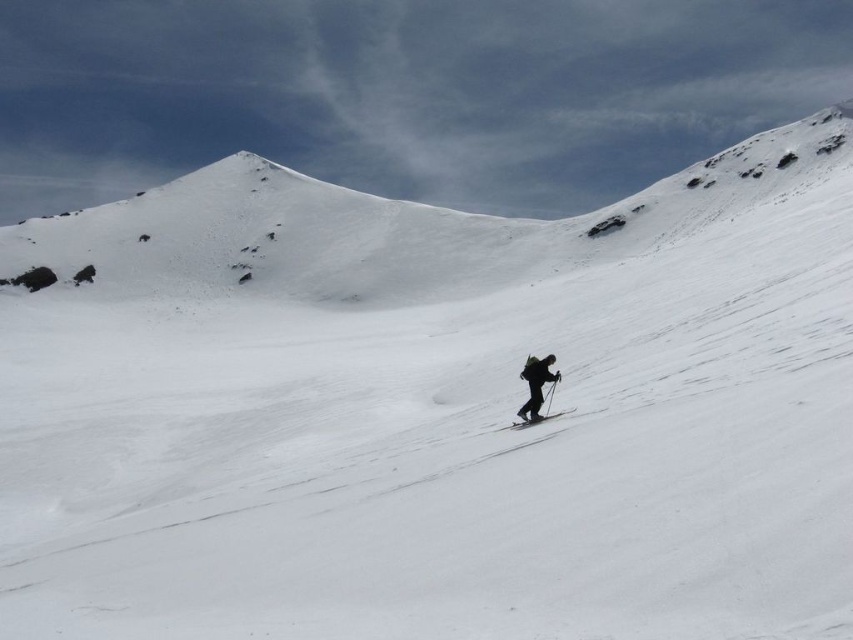
Question: Among these points, which one is nearest to the camera?

Choices:
 (A) (520, 372)
 (B) (550, 416)
 (C) (518, 413)

Answer: (B)

Question: Estimate the real-world distances between objects in this image. Which object is farther from the black fabric backpack at center?

Choices:
 (A) black matte snowboarder at center
 (B) white snow-covered mountain at upper center
 (C) black matte ski at center

Answer: (B)

Question: Is white snow-covered mountain at upper center closer to the viewer compared to black fabric backpack at center?

Choices:
 (A) no
 (B) yes

Answer: (A)

Question: Does black fabric backpack at center appear on the right side of black matte ski at center?

Choices:
 (A) yes
 (B) no

Answer: (A)

Question: Which object is the closest to the black matte snowboarder at center?

Choices:
 (A) black fabric backpack at center
 (B) white snow-covered mountain at upper center
 (C) black matte ski at center

Answer: (A)

Question: Is the position of black fabric backpack at center less distant than that of black matte ski at center?

Choices:
 (A) no
 (B) yes

Answer: (A)